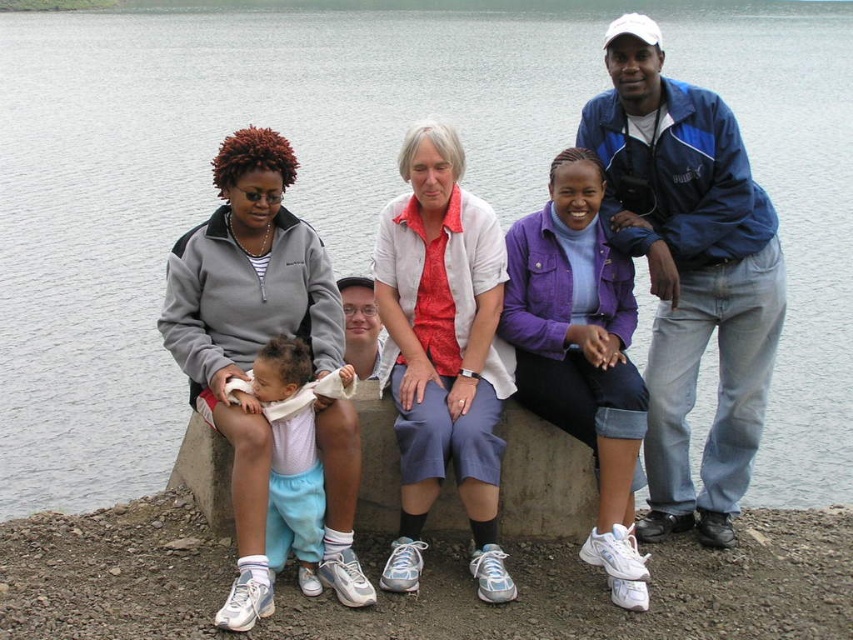
You are a photographer planning to take a group photo of the people sitting on the concrete bench. You notice the matte gray sweatshirt at left and the blue fabric jacket at upper right. Which clothing item should you adjust to ensure both are visible in the frame?

The matte gray sweatshirt at left has a lesser height compared to blue fabric jacket at upper right. To ensure both are visible, adjust the angle so the shorter matte gray sweatshirt at left is not blocked by the taller blue fabric jacket at upper right.

Looking at this image, you are a photographer standing at the camera position. You want to take a photo of the group, but the blue fabric jacket at upper right is too far away. How can you adjust your position to make it appear closer in the photo?

Move closer to the blue fabric jacket at upper right by 21.82 meters so it is at the camera position.

You are a photographer trying to capture a photo of the light blue cotton pants at center and the blue fabric jacket at upper right. From your current position, which object is closer to you?

The blue fabric jacket at upper right is closer to you because it is in front of the light blue cotton pants at center.